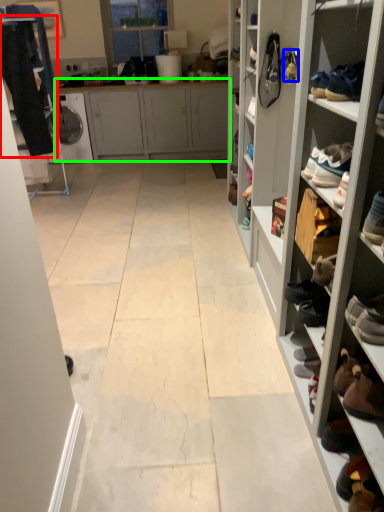
Question: Estimate the real-world distances between objects in this image. Which object is farther from clothing (highlighted by a red box), shoe (highlighted by a blue box) or cabinetry (highlighted by a green box)?

Choices:
 (A) shoe
 (B) cabinetry

Answer: (A)